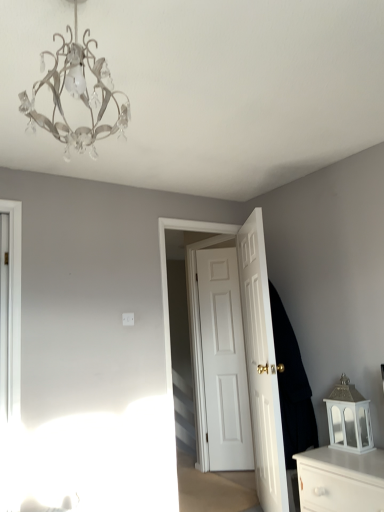
Question: In the image, is white glossy door at center, the first door in the front-to-back sequence, positioned in front of or behind white glossy chest of drawers at lower right?

Choices:
 (A) behind
 (B) front

Answer: (A)

Question: Choose the correct answer: Is white glossy door at center, the 3th door positioned from the back, inside white glossy chest of drawers at lower right or outside it?

Choices:
 (A) outside
 (B) inside

Answer: (A)

Question: Which object is positioned closest to the white glossy chest of drawers at lower right?

Choices:
 (A) white glossy door at center, which appears as the 2th door when viewed from the front
 (B) dark matte coat at right
 (C) metallic chandelier at upper left
 (D) white glossy door at center, the 3th door positioned from the back
 (E) white matte door at center, the third door positioned from the front

Answer: (B)

Question: Which is nearer to the white matte door at center, the third door positioned from the front?

Choices:
 (A) white glossy door at center, the 3th door positioned from the back
 (B) dark matte coat at right
 (C) white glossy chest of drawers at lower right
 (D) metallic chandelier at upper left
 (E) white glossy door at center, the second door positioned from the back

Answer: (A)